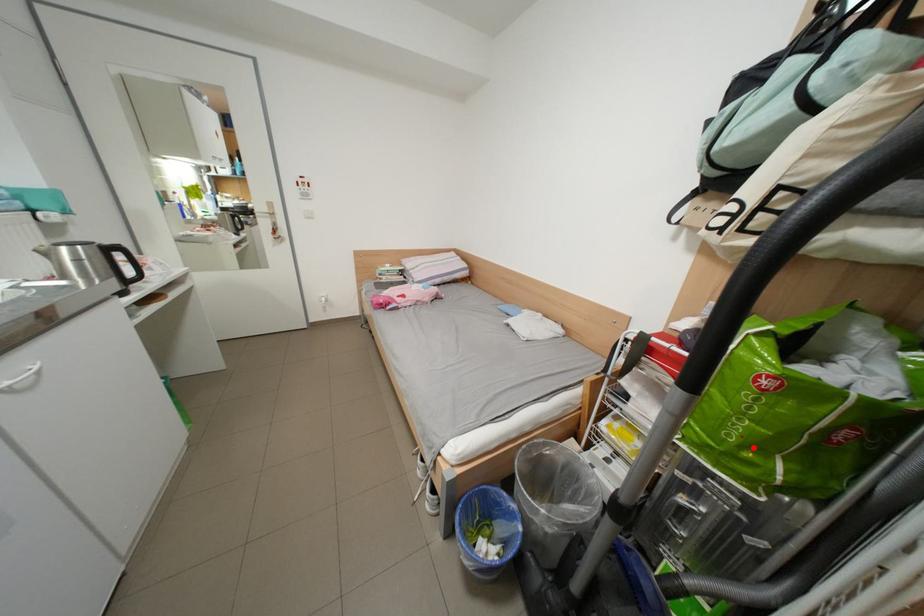
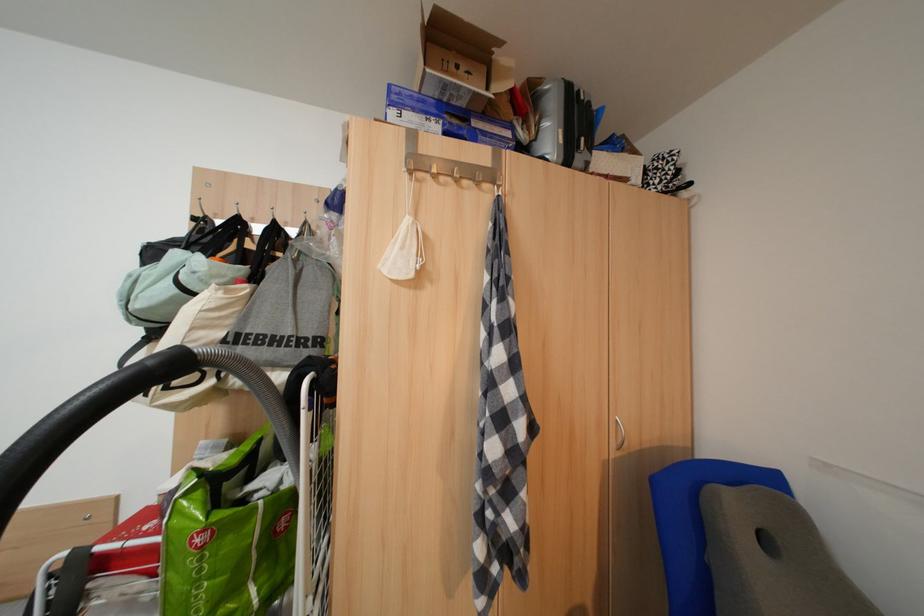
Find the pixel in the second image that matches the highlighted location in the first image.

(225, 610)